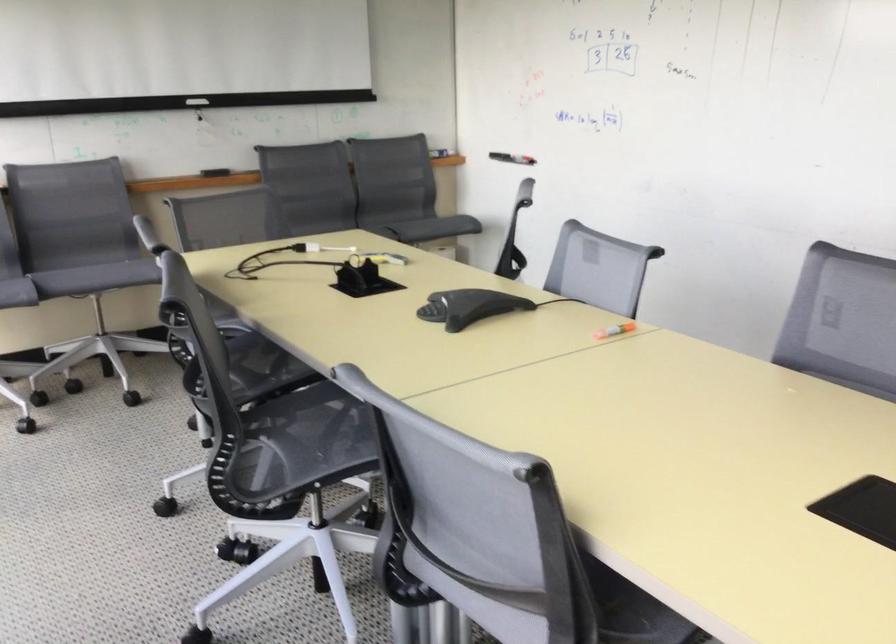
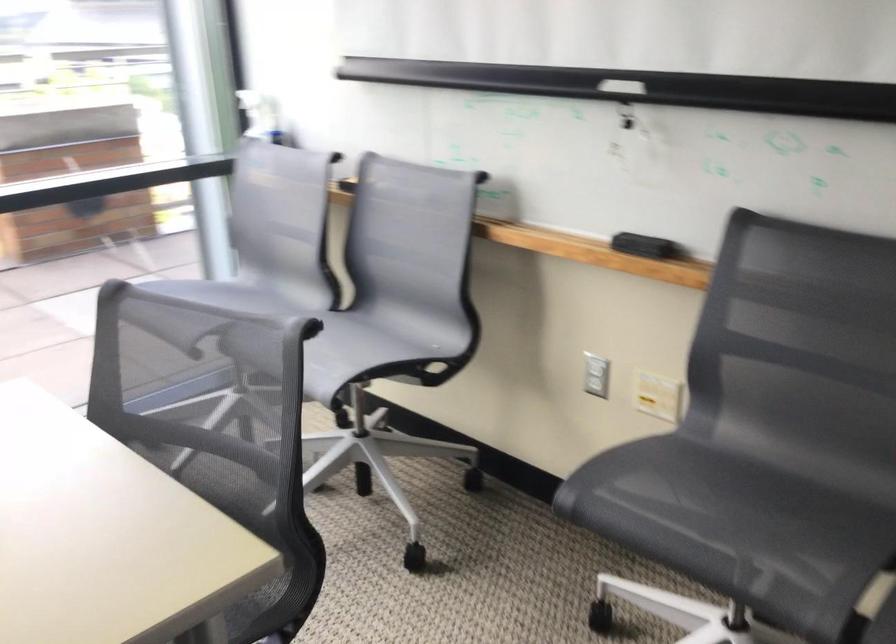
Find the pixel in the second image that matches the point at 93,160 in the first image.

(457, 182)